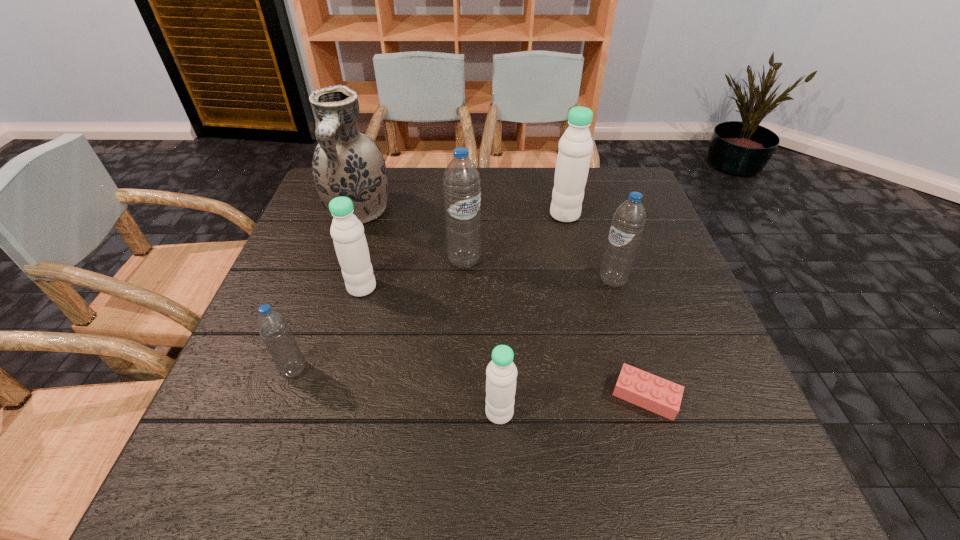
This screenshot has height=540, width=960. I want to click on the fifth farthest water bottle, so click(272, 325).

The image size is (960, 540). Find the location of `the second white water bottle from right to left`. the second white water bottle from right to left is located at coordinates (501, 372).

Where is `the nearest water bottle`? the nearest water bottle is located at coordinates (501, 372).

Locate an element on the screen. pink Lego is located at coordinates (658, 395).

Where is `the shortest object`? This screenshot has height=540, width=960. the shortest object is located at coordinates (658, 395).

The width and height of the screenshot is (960, 540). Identify the location of vacant space located 0.370m with the handle on the side of the vase. (312, 348).

You are a GUI agent. You are given a task and a screenshot of the screen. Output one action in this format:
    pyautogui.click(x=<x>, y=<y>)
    Task: Click on the blank space located 0.080m on the front of the rightmost white water bottle
    
    Given the screenshot: What is the action you would take?
    pyautogui.click(x=571, y=242)

This screenshot has width=960, height=540. Identify the location of free space located 0.250m on the front of the second blue water bottle from right to left. (461, 357).

The height and width of the screenshot is (540, 960). I want to click on vacant space situated 0.090m on the left of the second smallest blue water bottle, so click(x=561, y=280).

This screenshot has width=960, height=540. I want to click on blank area located 0.360m on the back of the second smallest white water bottle, so tap(387, 193).